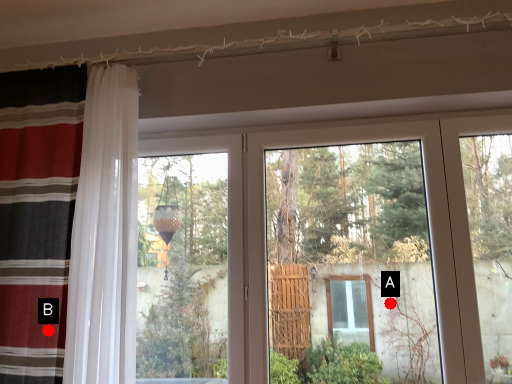
Question: Two points are circled on the image, labeled by A and B beside each circle. Which point is farther to the camera?

Choices:
 (A) A is further
 (B) B is further

Answer: (A)